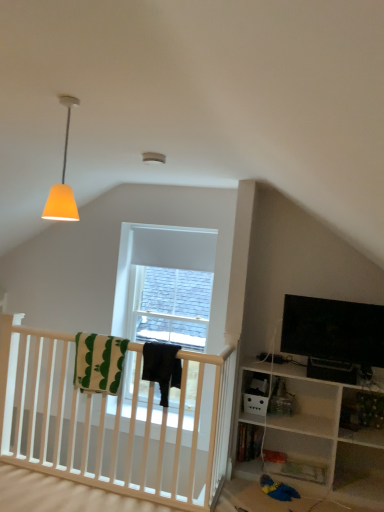
Question: Can you confirm if black fabric at center, the second blanket when ordered from left to right, is bigger than black glossy tv at right?

Choices:
 (A) yes
 (B) no

Answer: (B)

Question: Does black fabric at center, placed as the 1th blanket when sorted from right to left, have a lesser height compared to black glossy tv at right?

Choices:
 (A) yes
 (B) no

Answer: (A)

Question: Is black fabric at center, the second blanket when ordered from left to right, positioned beyond the bounds of black glossy tv at right?

Choices:
 (A) yes
 (B) no

Answer: (A)

Question: Is black fabric at center, the second blanket when ordered from left to right, oriented away from black glossy tv at right?

Choices:
 (A) yes
 (B) no

Answer: (B)

Question: From a real-world perspective, is black fabric at center, placed as the 1th blanket when sorted from right to left, beneath black glossy tv at right?

Choices:
 (A) no
 (B) yes

Answer: (B)

Question: Is black fabric at center, placed as the 1th blanket when sorted from right to left, in front of black glossy tv at right?

Choices:
 (A) no
 (B) yes

Answer: (B)

Question: From a real-world perspective, is white cotton blanket at center, positioned as the first blanket in left-to-right order, physically above black fabric at center, the second blanket when ordered from left to right?

Choices:
 (A) yes
 (B) no

Answer: (B)

Question: Is white cotton blanket at center, the second blanket in the right-to-left sequence, positioned far away from black fabric at center, placed as the 1th blanket when sorted from right to left?

Choices:
 (A) yes
 (B) no

Answer: (B)

Question: From the image's perspective, would you say white cotton blanket at center, positioned as the first blanket in left-to-right order, is positioned over black fabric at center, the second blanket when ordered from left to right?

Choices:
 (A) yes
 (B) no

Answer: (A)

Question: Is white cotton blanket at center, the second blanket in the right-to-left sequence, taller than black fabric at center, the second blanket when ordered from left to right?

Choices:
 (A) yes
 (B) no

Answer: (A)

Question: Considering the relative sizes of white cotton blanket at center, the second blanket in the right-to-left sequence, and black fabric at center, placed as the 1th blanket when sorted from right to left, in the image provided, is white cotton blanket at center, the second blanket in the right-to-left sequence, thinner than black fabric at center, placed as the 1th blanket when sorted from right to left,?

Choices:
 (A) no
 (B) yes

Answer: (B)

Question: Does white cotton blanket at center, positioned as the first blanket in left-to-right order, have a greater width compared to black fabric at center, the second blanket when ordered from left to right?

Choices:
 (A) yes
 (B) no

Answer: (B)

Question: Can we say orange matte lampshade at upper left lies outside white cotton blanket at center, positioned as the first blanket in left-to-right order?

Choices:
 (A) yes
 (B) no

Answer: (A)